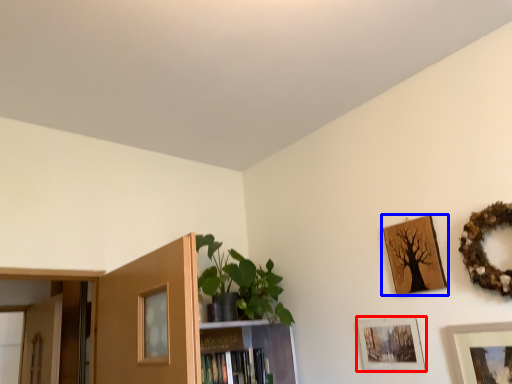
Question: Which object appears farthest to the camera in this image, picture frame (highlighted by a red box) or picture frame (highlighted by a blue box)?

Choices:
 (A) picture frame
 (B) picture frame

Answer: (A)